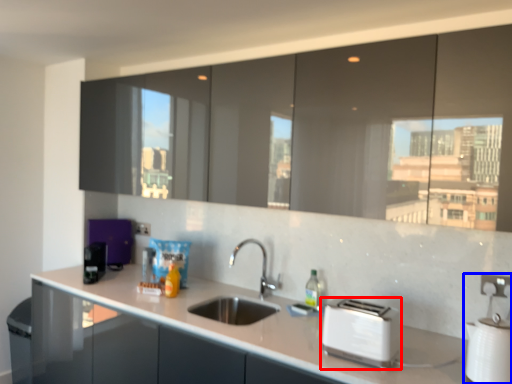
Question: Which object is further to the camera taking this photo, toaster (highlighted by a red box) or appliance (highlighted by a blue box)?

Choices:
 (A) toaster
 (B) appliance

Answer: (A)